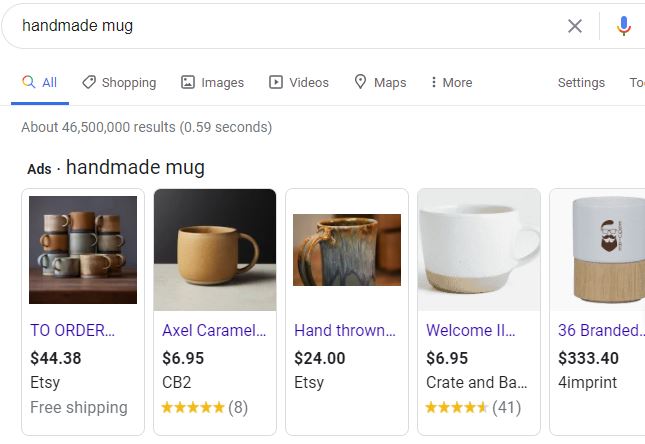
Locate an element on the screen. The image size is (645, 444). solid blue mug is located at coordinates (44, 261), (64, 261), (74, 244).